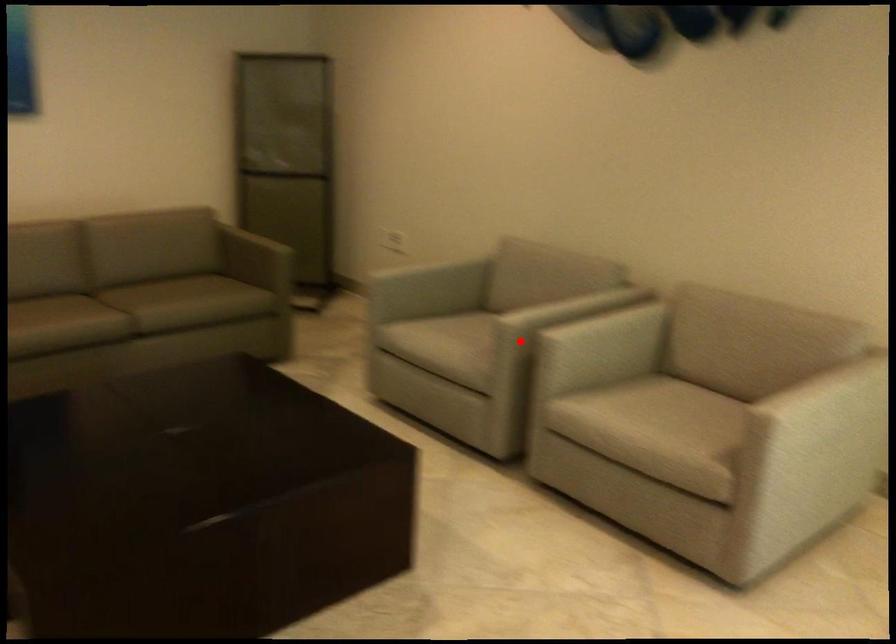
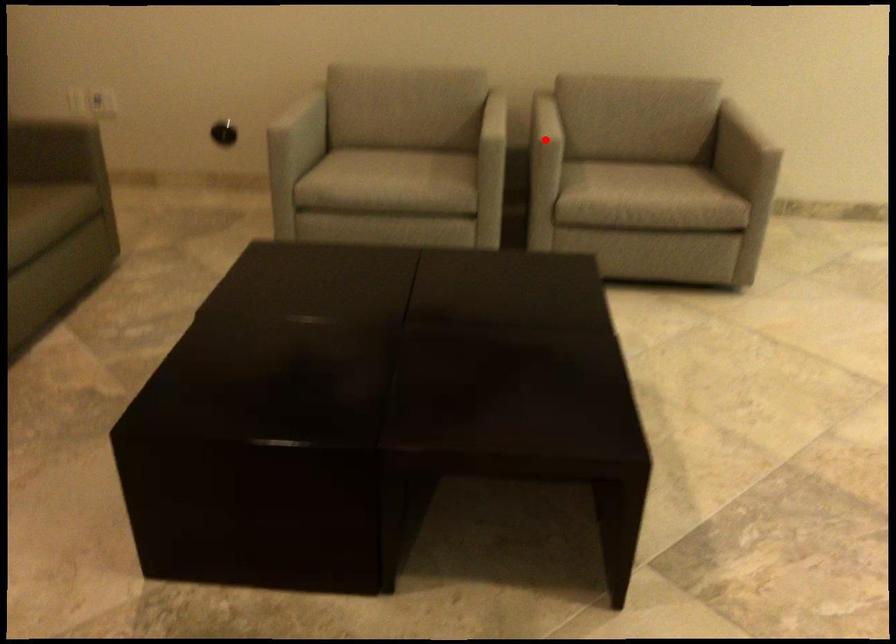
I am providing you with two images of the same scene from different viewpoints. A red point is marked on the first image and another point is marked on the second image. Is the red point in image1 aligned with the point shown in image2?

Yes